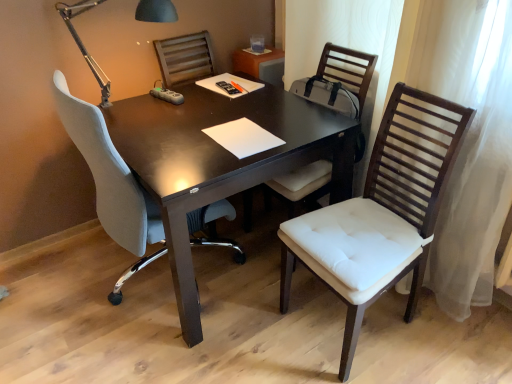
Question: From the image's perspective, is matte black table lamp at upper left located above or below white padded chair at right, which is the 1th chair in right-to-left order?

Choices:
 (A) above
 (B) below

Answer: (A)

Question: From a real-world perspective, is matte black table lamp at upper left physically located above or below white padded chair at right, which is the 1th chair in right-to-left order?

Choices:
 (A) below
 (B) above

Answer: (B)

Question: Which object is positioned farthest from the matte black table lamp at upper left?

Choices:
 (A) white padded chair at right, the 2th chair viewed from the left
 (B) white padded chair at right, the 3th chair from the left
 (C) white fabric chair at left, which is the 1th chair from left to right
 (D) white paper at center
 (E) dark wood table at center

Answer: (B)

Question: Which object is positioned farthest from the dark wood table at center?

Choices:
 (A) white padded chair at right, which is counted as the 2th chair, starting from the right
 (B) white paper at center
 (C) white padded chair at right, the 3th chair from the left
 (D) matte black table lamp at upper left
 (E) white fabric chair at left, the 3th chair when ordered from right to left

Answer: (D)